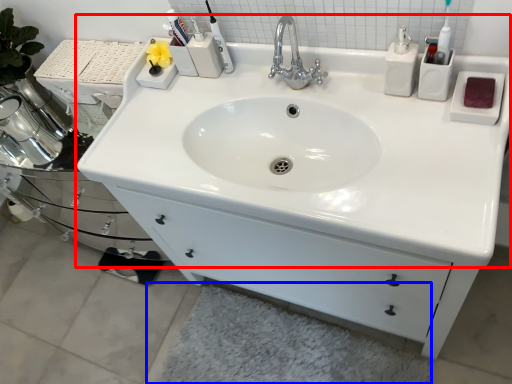
Question: Among these objects, which one is farthest to the camera, sink (highlighted by a red box) or bath mat (highlighted by a blue box)?

Choices:
 (A) sink
 (B) bath mat

Answer: (B)